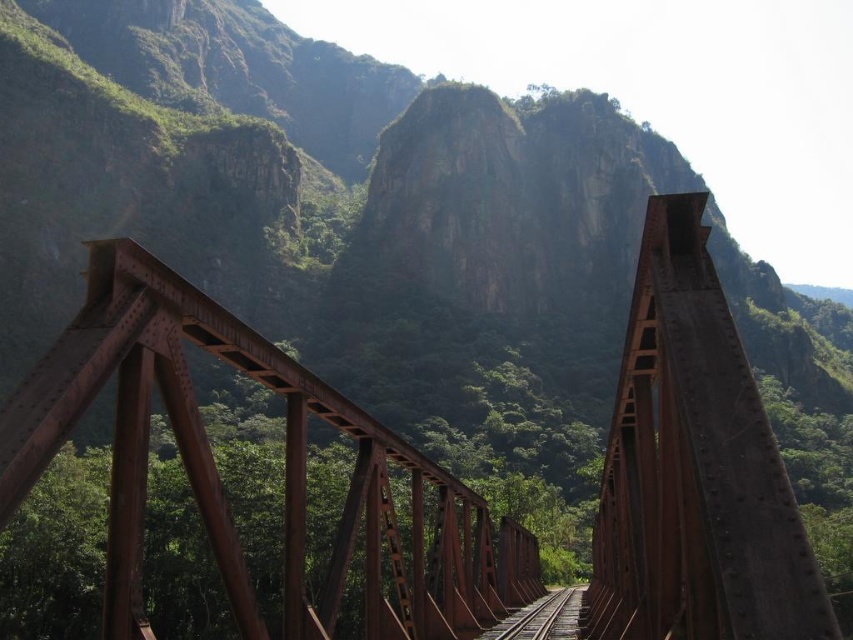
You are standing at the origin point of the coordinate system. You see a point marked at coordinates point (x=218, y=476). What object is located at that point?

The rusty metal train bridge at center is located at point (x=218, y=476).

You are a photographer standing on the railway bridge and want to capture a photo of the bridge and the tracks. Since the bridge is to the left of the tracks, where should you position yourself to ensure both the rusty metal train bridge at center and the rusty metal train track at center are fully visible in the frame?

Since the rusty metal train bridge at center is positioned on the left side of the rusty metal train track at center, you should position yourself to the right of the tracks to capture both objects in the frame.

You are a photographer planning to capture the rusty metal train bridge at center and the rusty metal train track at center in a single frame. Based on their sizes, which object would appear more prominent in your photo?

The rusty metal train bridge at center would appear more prominent in the photo since it has a larger size compared to the rusty metal train track at center.